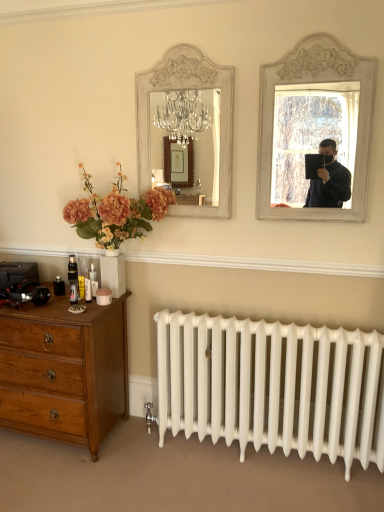
This screenshot has width=384, height=512. Describe the element at coordinates (315, 132) in the screenshot. I see `white painted wood mirror at upper right` at that location.

Identify the location of wooden dresser at lower left. This screenshot has height=512, width=384. (64, 371).

This screenshot has height=512, width=384. In order to click on the chest of drawers lying below the white painted wood mirror at upper right (from the image's perspective) in this screenshot , I will do `click(64, 371)`.

Based on the photo, who is smaller, wooden dresser at lower left or white painted wood mirror at upper right?

white painted wood mirror at upper right is smaller.

Which is closer to the camera, (38, 390) or (320, 64)?

The point (320, 64) is closer.

How many degrees apart are the facing directions of wooden dresser at lower left and white painted wood mirror at upper right?

0.162 degrees separate the facing orientations of wooden dresser at lower left and white painted wood mirror at upper right.

Which point is more forward, (x=308, y=74) or (x=213, y=78)?

Positioned in front is point (x=308, y=74).

Considering their positions, is white painted wood mirror at upper right located in front of or behind white painted wood mirror at upper center?

In the image, white painted wood mirror at upper right appears in front of white painted wood mirror at upper center.

Considering the sizes of white painted wood mirror at upper right and white painted wood mirror at upper center in the image, is white painted wood mirror at upper right wider or thinner than white painted wood mirror at upper center?

Considering their sizes, white painted wood mirror at upper right looks broader than white painted wood mirror at upper center.

From the image's perspective, is white painted wood mirror at upper right beneath white painted wood mirror at upper center?

Yes, from the image's perspective, white painted wood mirror at upper right is below white painted wood mirror at upper center.

What's the angular difference between white painted wood mirror at upper center and wooden dresser at lower left's facing directions?

0.127 degrees.

From a real-world perspective, is white painted wood mirror at upper center under wooden dresser at lower left?

No, from a real-world perspective, white painted wood mirror at upper center is not under wooden dresser at lower left.

From the image's perspective, is white painted wood mirror at upper center below wooden dresser at lower left?

No.

Locate an element on the screen. The image size is (384, 512). mirror lying above the wooden dresser at lower left (from the image's perspective) is located at coordinates (187, 88).

Which of these two, white painted wood mirror at upper center or white painted wood mirror at upper right, stands taller?

white painted wood mirror at upper right is taller.

Is white painted wood mirror at upper center oriented away from white painted wood mirror at upper right?

No, white painted wood mirror at upper center's orientation is not away from white painted wood mirror at upper right.

Between white painted wood mirror at upper center and white painted wood mirror at upper right, which one has larger size?

Bigger between the two is white painted wood mirror at upper right.

Does point (115, 322) appear closer or farther from the camera than point (172, 210)?

Point (115, 322) is positioned closer to the camera compared to point (172, 210).

From a real-world perspective, is wooden dresser at lower left above or below white painted wood mirror at upper center?

wooden dresser at lower left is situated lower than white painted wood mirror at upper center in the real world.

Is wooden dresser at lower left thinner than white painted wood mirror at upper center?

In fact, wooden dresser at lower left might be wider than white painted wood mirror at upper center.

Does wooden dresser at lower left turn towards white painted wood mirror at upper center?

No, wooden dresser at lower left is not turned towards white painted wood mirror at upper center.

Visually, is white painted wood mirror at upper right positioned to the left or to the right of wooden dresser at lower left?

From the image, it's evident that white painted wood mirror at upper right is to the right of wooden dresser at lower left.

Could you tell me if white painted wood mirror at upper right is facing wooden dresser at lower left?

No, white painted wood mirror at upper right is not facing towards wooden dresser at lower left.

In the scene shown: Which is in front, white painted wood mirror at upper right or wooden dresser at lower left?

Positioned in front is white painted wood mirror at upper right.

Locate an element on the screen. Image resolution: width=384 pixels, height=512 pixels. the chest of drawers located below the white painted wood mirror at upper right (from the image's perspective) is located at coordinates (64, 371).

Find the location of `picture frame in front of the white painted wood mirror at upper center`. picture frame in front of the white painted wood mirror at upper center is located at coordinates (315, 132).

When comparing their distances from white painted wood mirror at upper center, does wooden dresser at lower left or white painted wood mirror at upper right seem further?

The object further to white painted wood mirror at upper center is wooden dresser at lower left.

Based on their spatial positions, is white painted wood mirror at upper right or wooden dresser at lower left closer to white painted wood mirror at upper center?

The object closer to white painted wood mirror at upper center is white painted wood mirror at upper right.

Estimate the real-world distances between objects in this image. Which object is closer to white painted wood mirror at upper right, wooden dresser at lower left or white painted wood mirror at upper center?

white painted wood mirror at upper center is positioned closer to the anchor white painted wood mirror at upper right.

Looking at this image, based on their spatial positions, is white painted wood mirror at upper center or white painted wood mirror at upper right further from wooden dresser at lower left?

white painted wood mirror at upper right.

Based on their spatial positions, is white painted wood mirror at upper center or wooden dresser at lower left further from white painted wood mirror at upper right?

wooden dresser at lower left lies further to white painted wood mirror at upper right than the other object.

When comparing their distances from wooden dresser at lower left, does white painted wood mirror at upper right or white painted wood mirror at upper center seem closer?

Among the two, white painted wood mirror at upper center is located nearer to wooden dresser at lower left.

Identify the location of mirror between wooden dresser at lower left and white painted wood mirror at upper right in the horizontal direction. Image resolution: width=384 pixels, height=512 pixels. (187, 88).